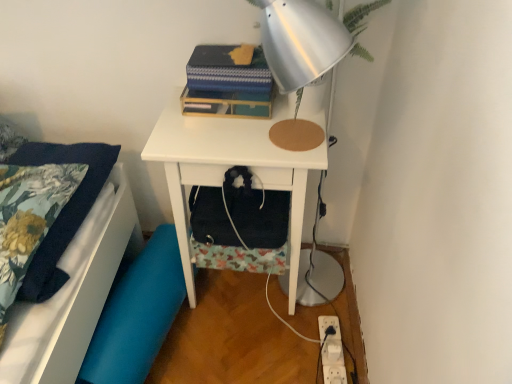
Question: Considering the positions of point (135, 342) and point (291, 182), is point (135, 342) closer or farther from the camera than point (291, 182)?

Choices:
 (A) farther
 (B) closer

Answer: (A)

Question: From a real-world perspective, relative to white matte nightstand at center, is blue fabric swivel chair at lower left vertically above or below?

Choices:
 (A) below
 (B) above

Answer: (A)

Question: Considering the real-world distances, which object is farthest from the blue textured notebook at upper center?

Choices:
 (A) white matte nightstand at center
 (B) white plastic electric outlet at lower right
 (C) silver metallic lamp at upper center
 (D) blue fabric swivel chair at lower left
 (E) floral fabric pillowcase at left

Answer: (B)

Question: Estimate the real-world distances between objects in this image. Which object is farther from the silver metallic lamp at upper center?

Choices:
 (A) white plastic electric outlet at lower right
 (B) floral fabric pillowcase at left
 (C) blue fabric swivel chair at lower left
 (D) white matte nightstand at center
 (E) blue textured notebook at upper center

Answer: (A)